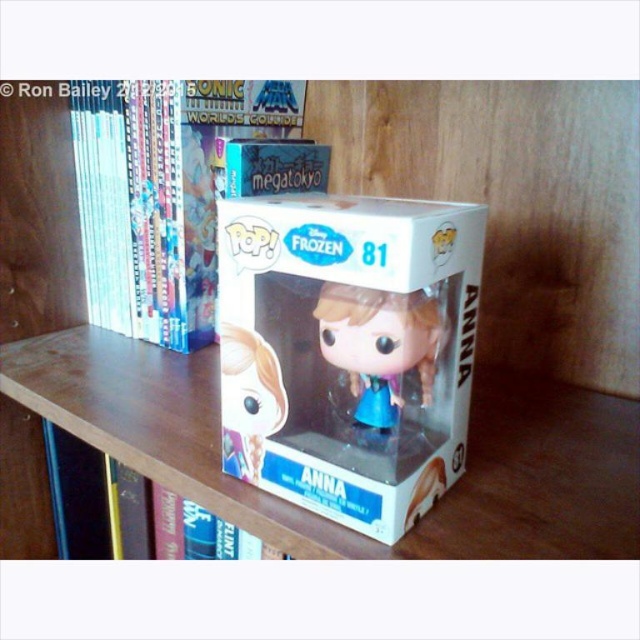
Question: Estimate the real-world distances between objects in this image. Which object is closer to the white glossy box at center?

Choices:
 (A) translucent plastic anna figurine at center
 (B) translucent plastic figurine at center

Answer: (B)

Question: Is white glossy box at center to the right of translucent plastic figurine at center from the viewer's perspective?

Choices:
 (A) no
 (B) yes

Answer: (A)

Question: Which of the following is the farthest from the observer?

Choices:
 (A) (348, 365)
 (B) (328, 216)
 (C) (268, 416)

Answer: (C)

Question: Which object is the farthest from the white glossy box at center?

Choices:
 (A) translucent plastic figurine at center
 (B) translucent plastic anna figurine at center

Answer: (B)

Question: Is white glossy box at center below translucent plastic figurine at center?

Choices:
 (A) no
 (B) yes

Answer: (A)

Question: Does translucent plastic figurine at center appear on the right side of translucent plastic anna figurine at center?

Choices:
 (A) no
 (B) yes

Answer: (B)